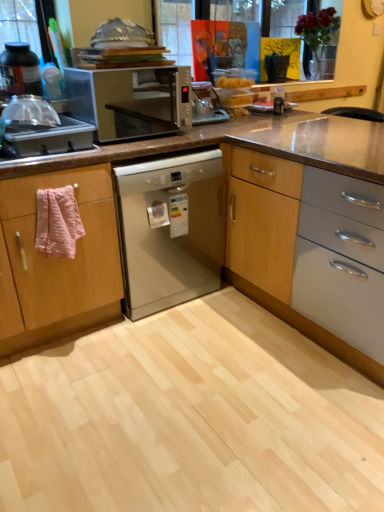
Question: Does brushed metal sink at left, the second kitchen appliance positioned from the top, have a lesser width compared to matte black bottle at left, which is the 2th kitchen appliance from bottom to top?

Choices:
 (A) no
 (B) yes

Answer: (A)

Question: Does brushed metal sink at left, positioned as the 1th kitchen appliance in bottom-to-top order, have a larger size compared to matte black bottle at left, which is the 2th kitchen appliance from bottom to top?

Choices:
 (A) no
 (B) yes

Answer: (B)

Question: Is brushed metal sink at left, positioned as the 1th kitchen appliance in bottom-to-top order, to the right of matte black bottle at left, marked as the first kitchen appliance in a top-to-bottom arrangement, from the viewer's perspective?

Choices:
 (A) yes
 (B) no

Answer: (A)

Question: Is brushed metal sink at left, positioned as the 1th kitchen appliance in bottom-to-top order, positioned with its back to matte black bottle at left, which is the 2th kitchen appliance from bottom to top?

Choices:
 (A) yes
 (B) no

Answer: (B)

Question: Is brushed metal sink at left, positioned as the 1th kitchen appliance in bottom-to-top order, shorter than matte black bottle at left, which is the 2th kitchen appliance from bottom to top?

Choices:
 (A) yes
 (B) no

Answer: (A)

Question: From a real-world perspective, does brushed metal sink at left, positioned as the 1th kitchen appliance in bottom-to-top order, sit lower than matte black bottle at left, marked as the first kitchen appliance in a top-to-bottom arrangement?

Choices:
 (A) yes
 (B) no

Answer: (A)

Question: Considering the relative sizes of matte black bottle at left, which is the 2th kitchen appliance from bottom to top, and brushed metal sink at left, the second kitchen appliance positioned from the top, in the image provided, is matte black bottle at left, which is the 2th kitchen appliance from bottom to top, shorter than brushed metal sink at left, the second kitchen appliance positioned from the top,?

Choices:
 (A) no
 (B) yes

Answer: (A)

Question: Can you confirm if matte black bottle at left, which is the 2th kitchen appliance from bottom to top, is wider than brushed metal sink at left, positioned as the 1th kitchen appliance in bottom-to-top order?

Choices:
 (A) yes
 (B) no

Answer: (B)

Question: Is matte black bottle at left, marked as the first kitchen appliance in a top-to-bottom arrangement, looking in the opposite direction of brushed metal sink at left, the second kitchen appliance positioned from the top?

Choices:
 (A) no
 (B) yes

Answer: (A)

Question: From the image's perspective, is matte black bottle at left, marked as the first kitchen appliance in a top-to-bottom arrangement, on top of brushed metal sink at left, positioned as the 1th kitchen appliance in bottom-to-top order?

Choices:
 (A) yes
 (B) no

Answer: (A)

Question: Is matte black bottle at left, which is the 2th kitchen appliance from bottom to top, aimed at brushed metal sink at left, the second kitchen appliance positioned from the top?

Choices:
 (A) yes
 (B) no

Answer: (A)

Question: From a real-world perspective, is matte black bottle at left, marked as the first kitchen appliance in a top-to-bottom arrangement, located beneath brushed metal sink at left, positioned as the 1th kitchen appliance in bottom-to-top order?

Choices:
 (A) yes
 (B) no

Answer: (B)

Question: Is pink textured towel at left not near metallic silver microwave at center?

Choices:
 (A) yes
 (B) no

Answer: (B)